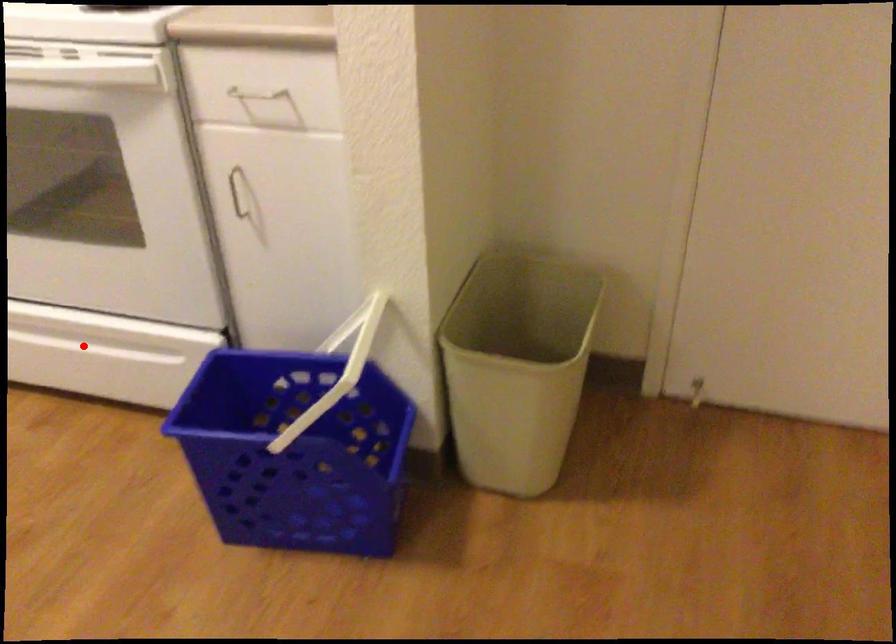
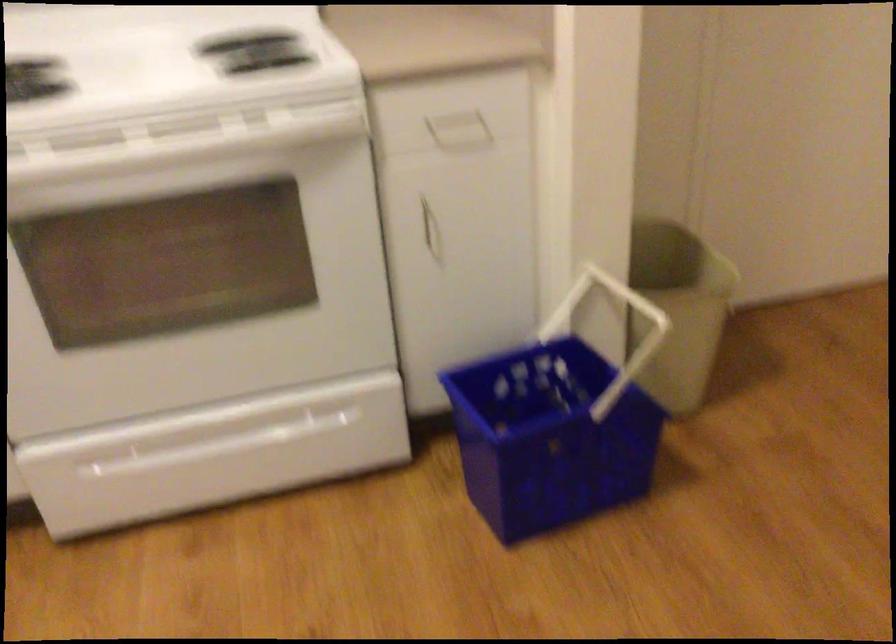
Question: I am providing you with two images of the same scene from different viewpoints. In image1, a red point is highlighted. Considering the same 3D point in image2, which of the following is correct?

Choices:
 (A) It is closer
 (B) It is farther

Answer: (A)